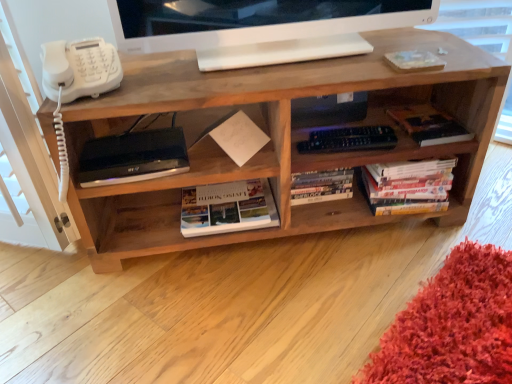
Question: Looking at their shapes, would you say white glossy monitor at upper center is wider or thinner than satin black device at lower left?

Choices:
 (A) wide
 (B) thin

Answer: (B)

Question: Is white glossy monitor at upper center bigger or smaller than satin black device at lower left?

Choices:
 (A) big
 (B) small

Answer: (A)

Question: Considering the real-world distances, which object is closest to the satin black device at lower left?

Choices:
 (A) hardcover book at center-right, which is counted as the 3th book, starting from the left
 (B) white glossy monitor at upper center
 (C) white glossy book at center, which appears as the 3th book when viewed from the right
 (D) hardcover books at right, the second book positioned from the right
 (E) white plastic phone at left

Answer: (E)

Question: Considering the real-world distances, which object is closest to the hardcover book at center-right, which is counted as the 3th book, starting from the left?

Choices:
 (A) white glossy book at center, arranged as the first book when viewed from the left
 (B) white glossy monitor at upper center
 (C) hardcover books at right, the second book positioned from the right
 (D) white plastic phone at left
 (E) natural wood shelf at center

Answer: (C)